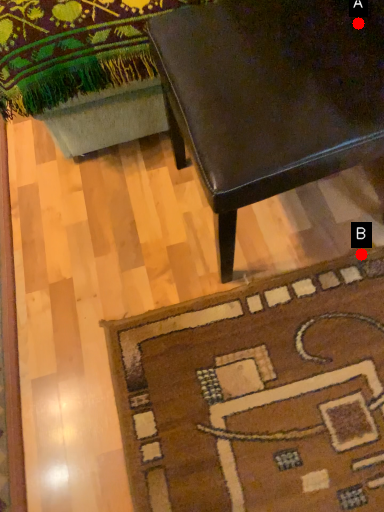
Question: Two points are circled on the image, labeled by A and B beside each circle. Which point is further to the camera?

Choices:
 (A) A is further
 (B) B is further

Answer: (B)